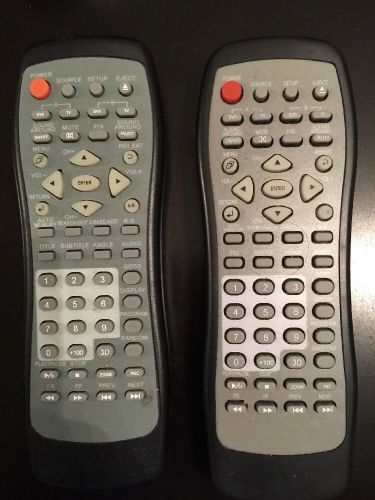
Identify the location of light glare on table. (363, 279).